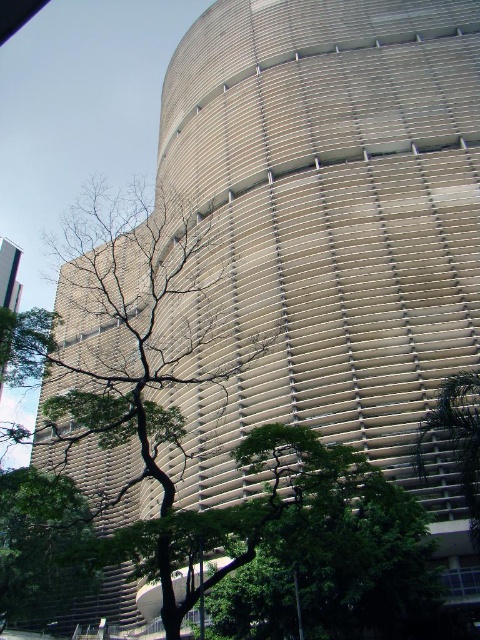
Is green leafy tree at center behind green leafy tree at lower right?

No, green leafy tree at center is in front of green leafy tree at lower right.

Which is in front, point (192, 300) or point (453, 449)?

Point (453, 449) is in front.

Between point (120, 209) and point (464, 372), which one is positioned in front?

Point (464, 372)

You are a GUI agent. You are given a task and a screenshot of the screen. Output one action in this format:
    pyautogui.click(x=<x>, y=<y>)
    Task: Click on the green leafy tree at center
    
    Given the screenshot: What is the action you would take?
    pyautogui.click(x=135, y=349)